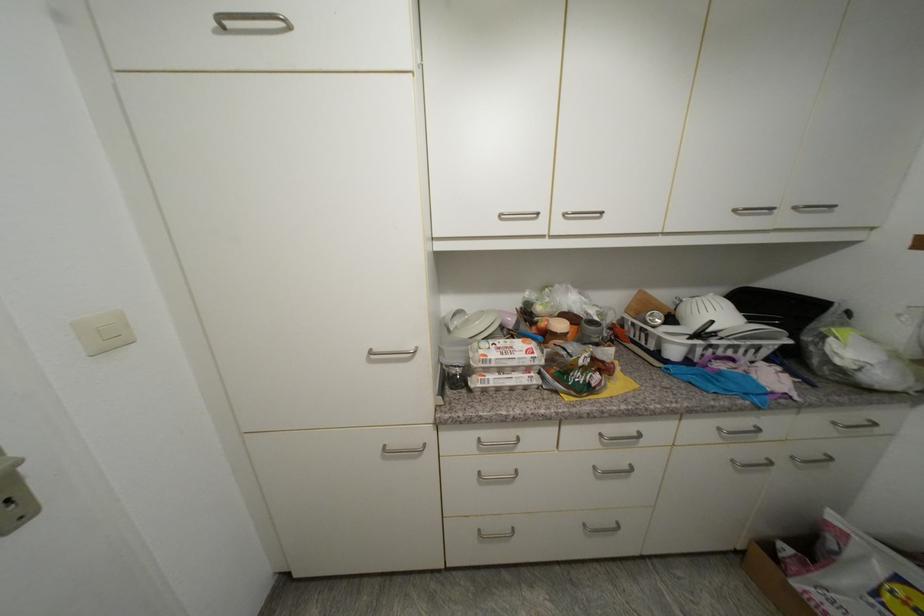
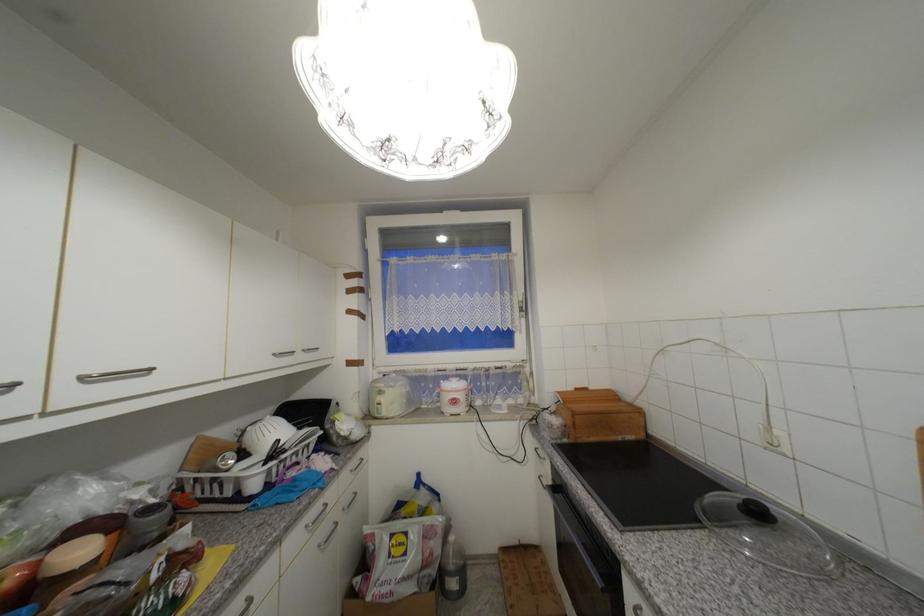
Find the pixel in the second image that matches pixel 751 453 in the first image.

(330, 531)